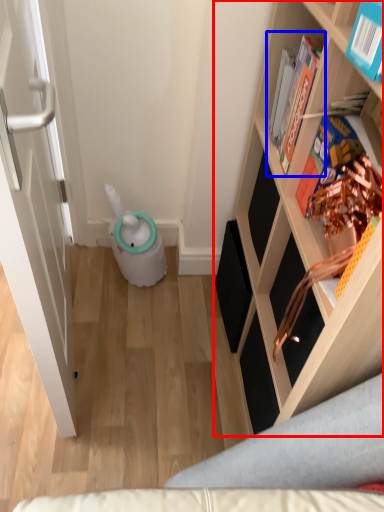
Question: Which object is closer to the camera taking this photo, shelf (highlighted by a red box) or book (highlighted by a blue box)?

Choices:
 (A) shelf
 (B) book

Answer: (A)